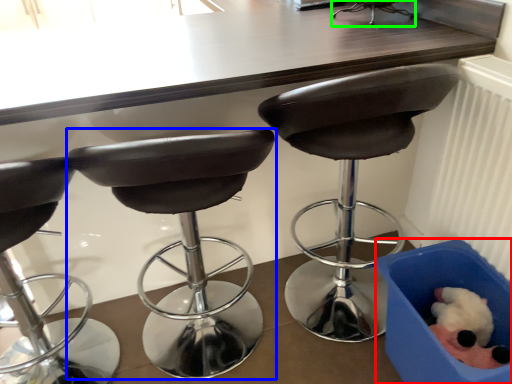
Question: Which object is the farthest from box (highlighted by a red box)? Choose among these: chair (highlighted by a blue box) or chair (highlighted by a green box).

Choices:
 (A) chair
 (B) chair

Answer: (B)